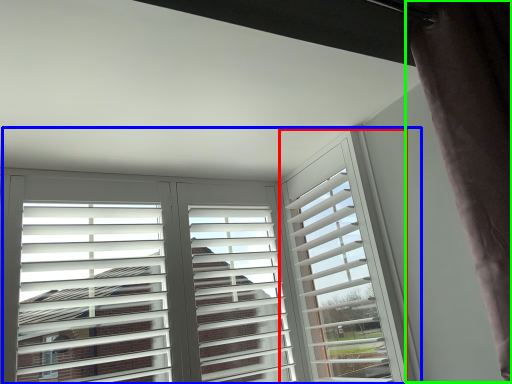
Question: Which object is the closest to the window frame (highlighted by a red box)? Choose among these: window (highlighted by a blue box) or curtain (highlighted by a green box).

Choices:
 (A) window
 (B) curtain

Answer: (A)